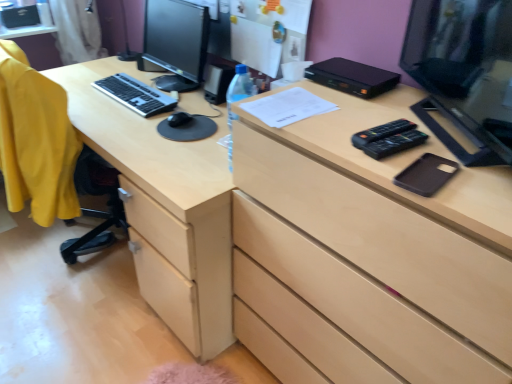
At what (x,y) coordinates should I click in order to perform the action: click on blank area beneath white paper at center (from a real-world perspective). Please return your answer as a coordinate pair (x, y). Looking at the image, I should click on (286, 103).